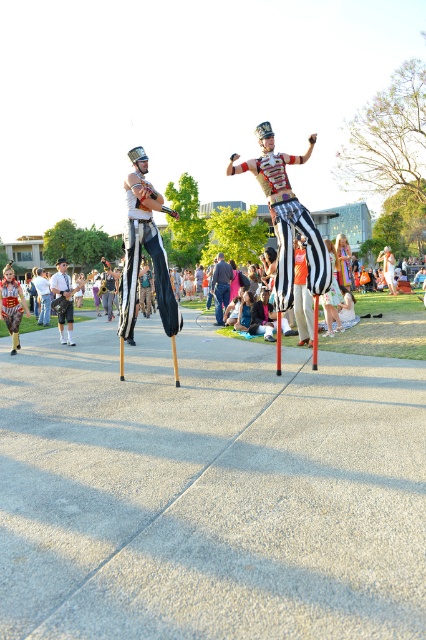
Can you confirm if striped fabric pants at center is shorter than denim pants at center?

No, striped fabric pants at center is not shorter than denim pants at center.

Is striped fabric pants at center wider than denim pants at center?

Yes, striped fabric pants at center is wider than denim pants at center.

Who is more distant from viewer, (305, 154) or (215, 278)?

Point (215, 278)

Where is `striped fabric pants at center`? striped fabric pants at center is located at coordinates (287, 216).

Does denim pants at center appear under denim jacket at center?

Yes.

Is denim pants at center above denim jacket at center?

Incorrect, denim pants at center is not positioned above denim jacket at center.

Is point (215, 282) positioned after point (46, 320)?

No.

I want to click on denim pants at center, so click(x=221, y=285).

Does black striped pants at center appear under denim pants at center?

No, black striped pants at center is not below denim pants at center.

In the scene shown: Between black striped pants at center and denim pants at center, which one is positioned lower?

denim pants at center is below.

Who is more distant from viewer, (143, 179) or (210, 284)?

The point (210, 284) is more distant.

Identify the location of black striped pants at center. The width and height of the screenshot is (426, 640). (144, 248).